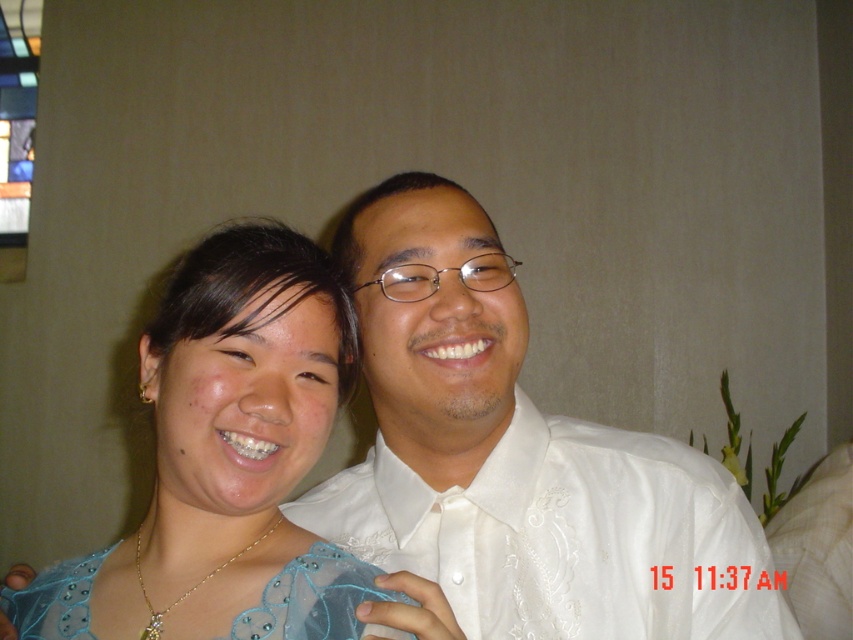
Can you confirm if white satin shirt at center is wider than blue satin dress at lower left?

Yes, white satin shirt at center is wider than blue satin dress at lower left.

Who is positioned more to the right, white satin shirt at center or blue satin dress at lower left?

white satin shirt at center

Is point (750, 544) farther from camera compared to point (167, 582)?

Yes, point (750, 544) is farther from viewer.

Where is `white satin shirt at center`? The height and width of the screenshot is (640, 853). white satin shirt at center is located at coordinates (518, 458).

Which of these two, blue satin dress at lower left or satin blue dress at lower left, stands taller?

→ blue satin dress at lower left is taller.

Between blue satin dress at lower left and satin blue dress at lower left, which one appears on the right side from the viewer's perspective?

blue satin dress at lower left

Does point (221, 348) come farther from viewer compared to point (358, 593)?

No, it is not.

Locate an element on the screen. blue satin dress at lower left is located at coordinates pos(233,436).

Can you confirm if white satin shirt at center is positioned to the left of satin blue dress at lower left?

In fact, white satin shirt at center is to the right of satin blue dress at lower left.

From the picture: Does white satin shirt at center appear over satin blue dress at lower left?

Indeed, white satin shirt at center is positioned over satin blue dress at lower left.

You are a GUI agent. You are given a task and a screenshot of the screen. Output one action in this format:
    pyautogui.click(x=<x>, y=<y>)
    Task: Click on the white satin shirt at center
    The image size is (853, 640).
    Given the screenshot: What is the action you would take?
    pyautogui.click(x=518, y=458)